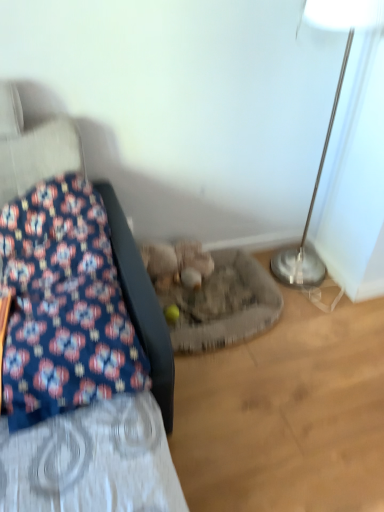
Question: Does fluffy beige stuffed animal at center have a lesser width compared to blue floral fabric at left?

Choices:
 (A) no
 (B) yes

Answer: (B)

Question: Considering the relative sizes of fluffy beige stuffed animal at center and blue floral fabric at left in the image provided, is fluffy beige stuffed animal at center taller than blue floral fabric at left?

Choices:
 (A) yes
 (B) no

Answer: (B)

Question: Can you confirm if fluffy beige stuffed animal at center is positioned to the left of blue floral fabric at left?

Choices:
 (A) no
 (B) yes

Answer: (A)

Question: Is fluffy beige stuffed animal at center further to camera compared to blue floral fabric at left?

Choices:
 (A) no
 (B) yes

Answer: (B)

Question: Does fluffy beige stuffed animal at center turn towards blue floral fabric at left?

Choices:
 (A) no
 (B) yes

Answer: (A)

Question: Considering the relative positions of silver metallic floor lamp at right and fluffy beige stuffed animal at center in the image provided, is silver metallic floor lamp at right to the left or to the right of fluffy beige stuffed animal at center?

Choices:
 (A) right
 (B) left

Answer: (A)

Question: Is silver metallic floor lamp at right inside or outside of fluffy beige stuffed animal at center?

Choices:
 (A) inside
 (B) outside

Answer: (B)

Question: Considering the positions of silver metallic floor lamp at right and fluffy beige stuffed animal at center in the image, is silver metallic floor lamp at right taller or shorter than fluffy beige stuffed animal at center?

Choices:
 (A) short
 (B) tall

Answer: (B)

Question: In terms of width, does silver metallic floor lamp at right look wider or thinner when compared to fluffy beige stuffed animal at center?

Choices:
 (A) wide
 (B) thin

Answer: (A)

Question: From the image's perspective, is fluffy beige stuffed animal at center positioned above or below silver metallic floor lamp at right?

Choices:
 (A) above
 (B) below

Answer: (B)

Question: In terms of height, does fluffy beige stuffed animal at center look taller or shorter compared to silver metallic floor lamp at right?

Choices:
 (A) short
 (B) tall

Answer: (A)

Question: Considering the positions of point (155, 248) and point (339, 25), is point (155, 248) closer or farther from the camera than point (339, 25)?

Choices:
 (A) farther
 (B) closer

Answer: (A)

Question: From a real-world perspective, is fluffy beige stuffed animal at center positioned above or below silver metallic floor lamp at right?

Choices:
 (A) below
 (B) above

Answer: (A)

Question: In terms of width, does blue floral fabric at left look wider or thinner when compared to fluffy beige stuffed animal at center?

Choices:
 (A) thin
 (B) wide

Answer: (B)

Question: Considering the positions of blue floral fabric at left and fluffy beige stuffed animal at center in the image, is blue floral fabric at left taller or shorter than fluffy beige stuffed animal at center?

Choices:
 (A) tall
 (B) short

Answer: (A)